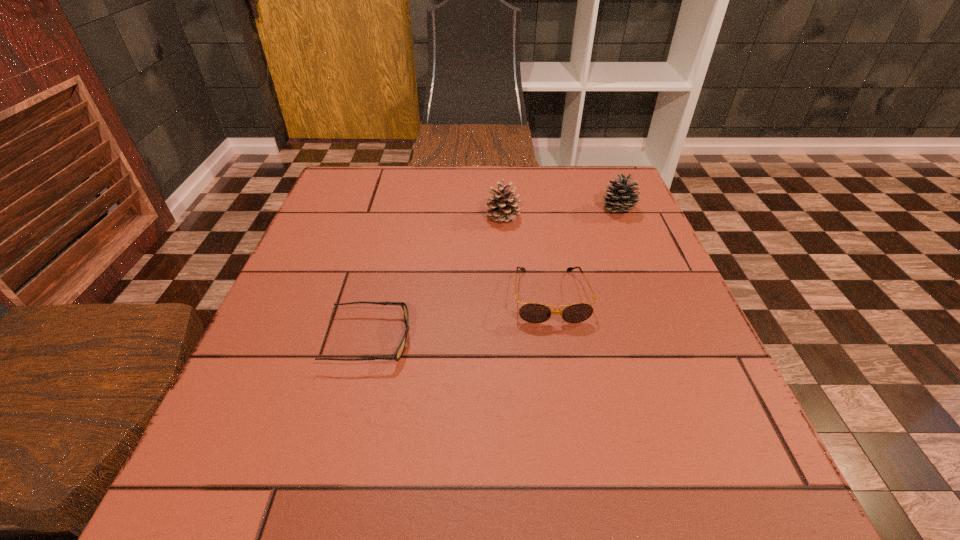
Identify which object is the nearest to the left pinecone. Please provide its 2D coordinates. Your answer should be formatted as a tuple, i.e. [(x, y)], where the tuple contains the x and y coordinates of a point satisfying the conditions above.

[(530, 312)]

Where is `the second closest object to the taller sunglasses`? the second closest object to the taller sunglasses is located at coordinates (400, 349).

The height and width of the screenshot is (540, 960). I want to click on vacant point that satisfies the following two spatial constraints: 1. on the lenses of the right sunglasses; 2. on the front-facing side of the left sunglasses, so click(558, 340).